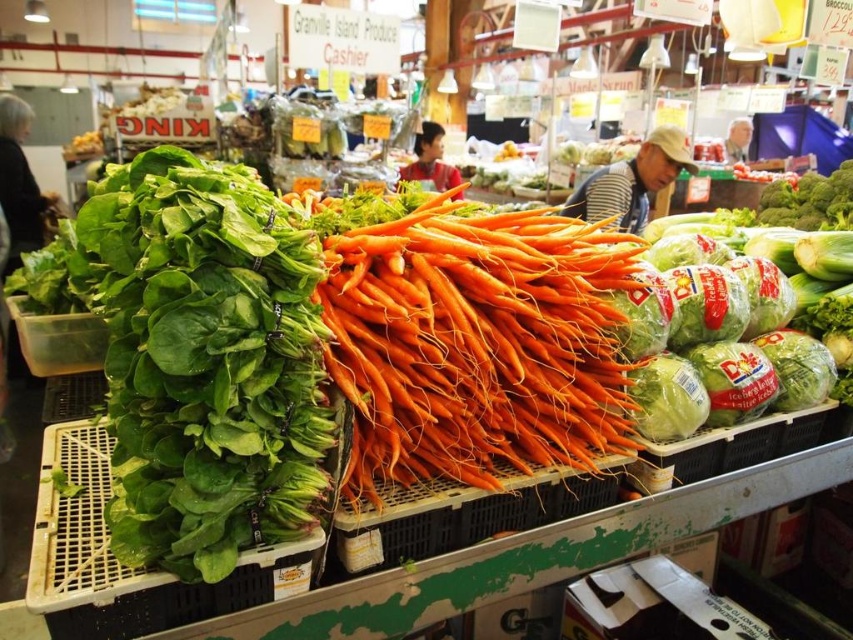
Does orange smooth carrots at center appear over green plastic bagged cabbage at center-right?

Correct, orange smooth carrots at center is located above green plastic bagged cabbage at center-right.

Does orange smooth carrots at center lie behind green plastic bagged cabbage at center-right?

No, it is in front of green plastic bagged cabbage at center-right.

Describe the element at coordinates (473, 339) in the screenshot. I see `orange smooth carrots at center` at that location.

Locate an element on the screen. This screenshot has width=853, height=640. orange smooth carrots at center is located at coordinates (473, 339).

Which is in front, point (692, 380) or point (788, 403)?

Point (692, 380)

Which is behind, point (677, 368) or point (776, 353)?

Positioned behind is point (776, 353).

Does point (688, 362) come behind point (834, 372)?

No, (688, 362) is in front of (834, 372).

You are a GUI agent. You are given a task and a screenshot of the screen. Output one action in this format:
    pyautogui.click(x=<x>, y=<y>)
    Task: Click on the green leafy at center
    The height and width of the screenshot is (640, 853).
    Given the screenshot: What is the action you would take?
    pyautogui.click(x=666, y=397)

Is point (125, 180) in front of point (578, 314)?

Yes, it is.

From the picture: Is green leafy at left bigger than orange smooth carrots at center?

No, green leafy at left is not bigger than orange smooth carrots at center.

The width and height of the screenshot is (853, 640). Find the location of `green leafy at left`. green leafy at left is located at coordinates (206, 362).

At what (x,y) coordinates should I click in order to perform the action: click on green leafy at left. Please return your answer as a coordinate pair (x, y). Looking at the image, I should click on (206, 362).